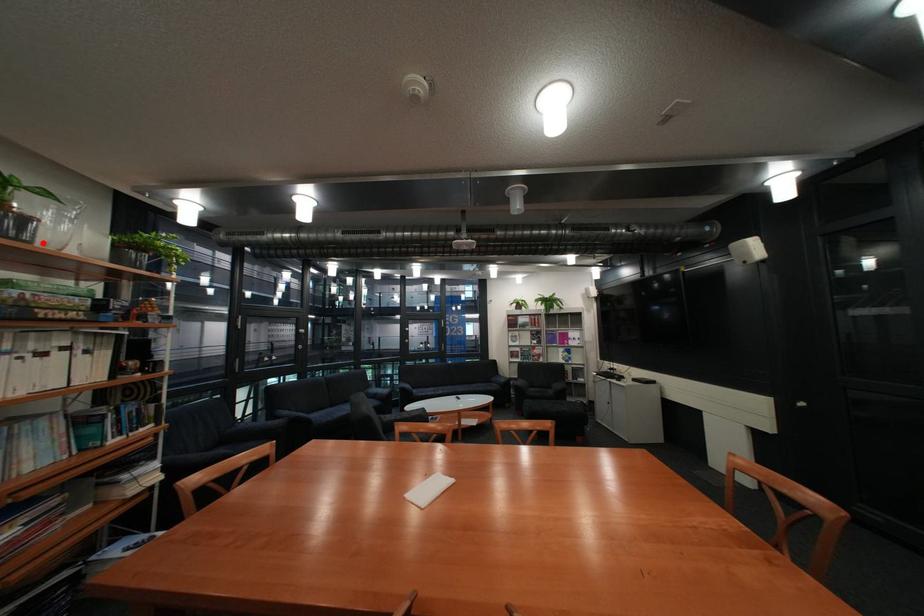
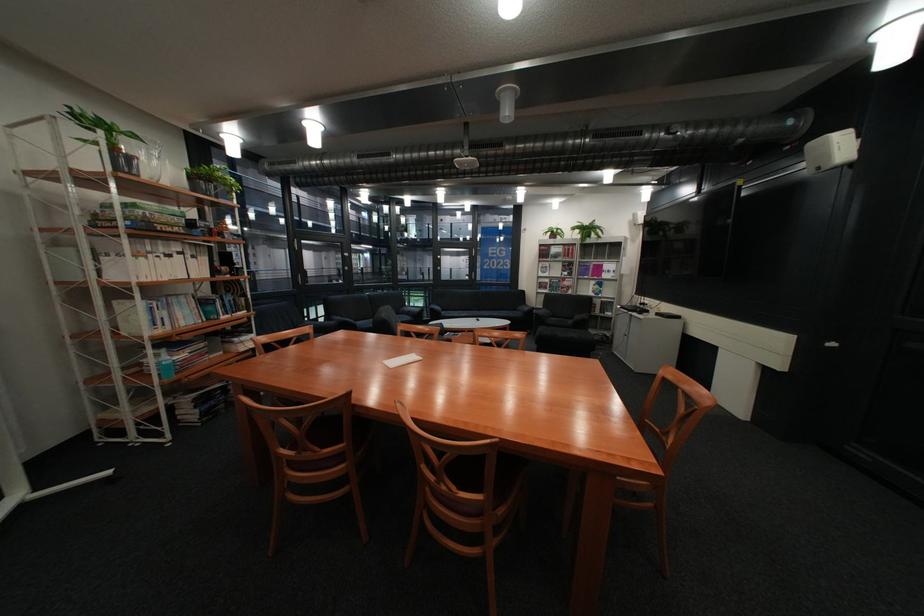
Find the pixel in the second image that matches the highlighted location in the first image.

(152, 177)